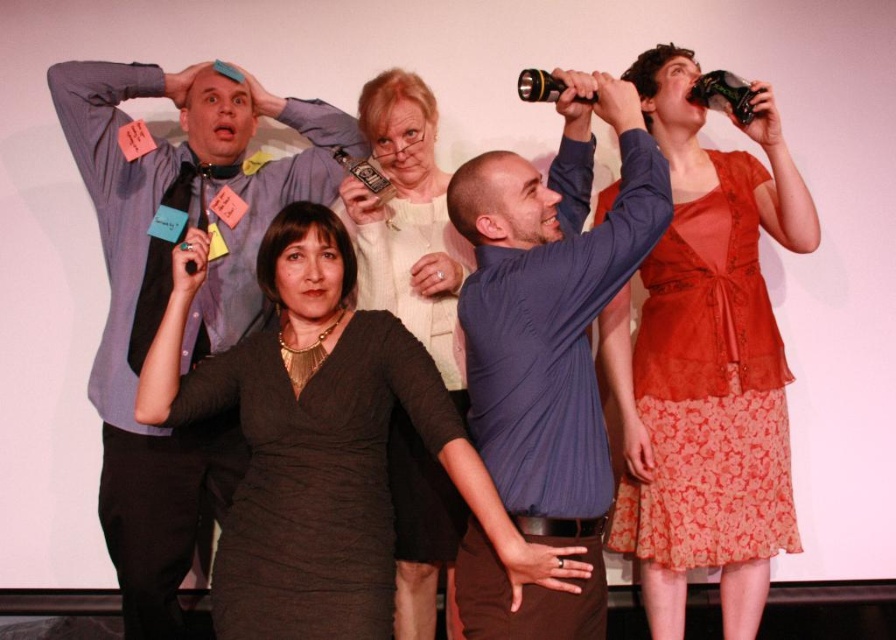
You are a photographer at the event and want to capture a photo that shows both the matte black dress at center and the matte orange blouse at upper right. Which one will appear taller in the photo?

The matte orange blouse at upper right will appear taller in the photo because it is taller than the matte black dress at center.

You are a photographer at the event and need to capture a photo that includes both the matte black dress at center and the matte white sweater at center. Based on their positions, which one should be placed to the left in the frame?

The matte black dress at center is positioned on the left side of the matte white sweater at center, so it should be placed to the left in the frame.